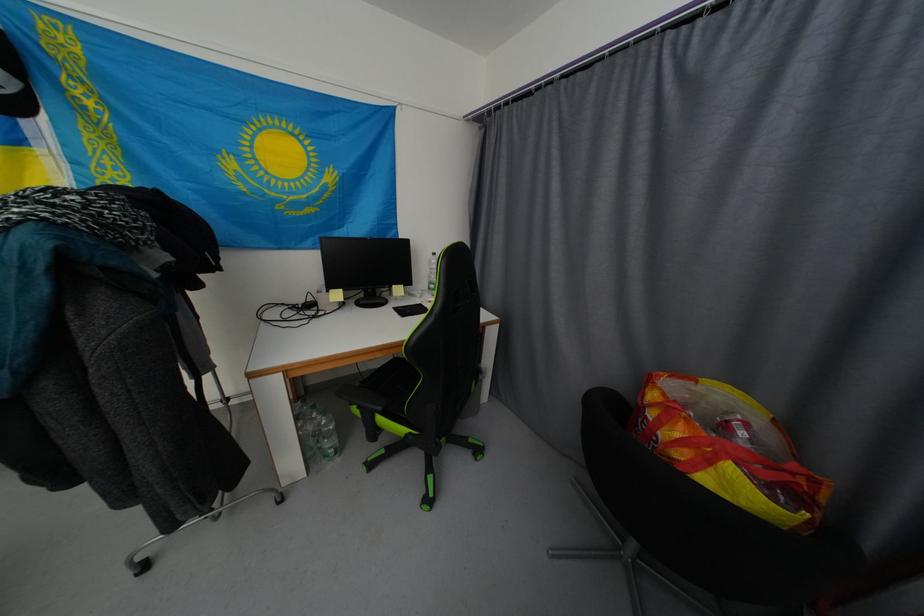
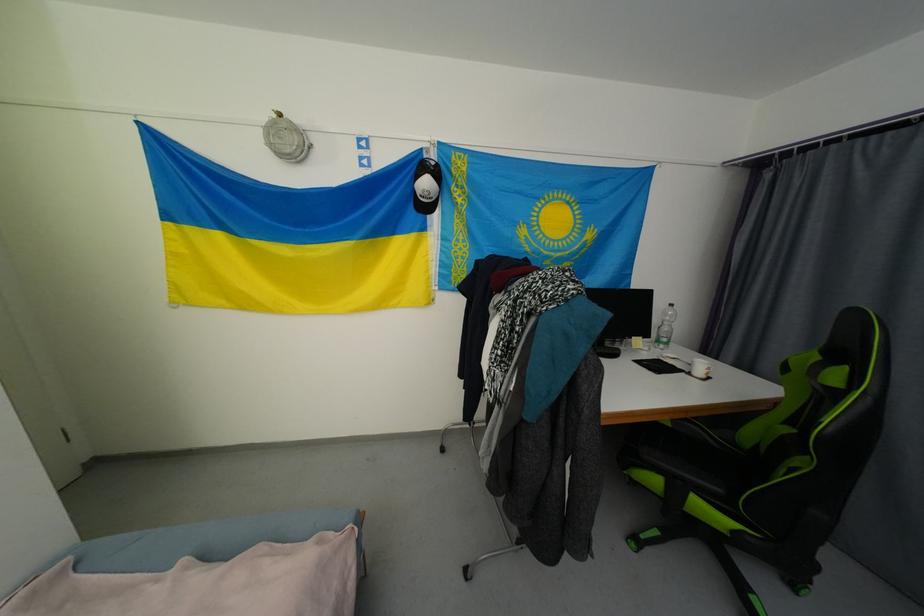
Question: What movement of the cameraman would produce the second image?

Choices:
 (A) Left
 (B) Right
 (C) Forward
 (D) Backward

Answer: (A)